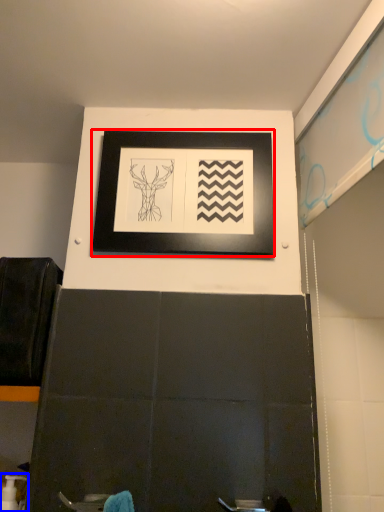
Question: Which point is closer to the camera, picture frame (highlighted by a red box) or toiletry (highlighted by a blue box)?

Choices:
 (A) picture frame
 (B) toiletry

Answer: (B)